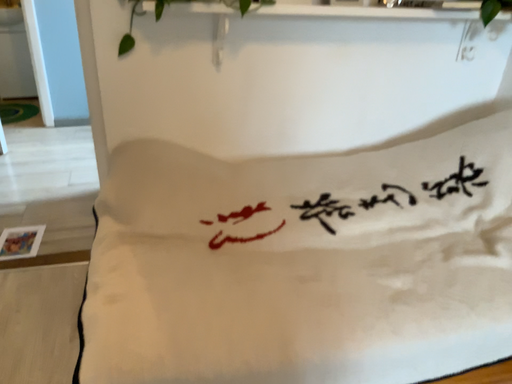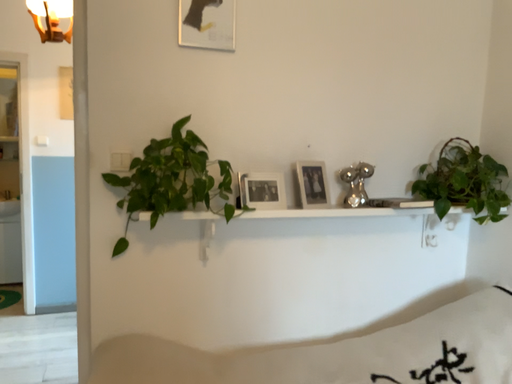
Question: Which way did the camera rotate in the video?

Choices:
 (A) rotated upward
 (B) rotated downward

Answer: (A)